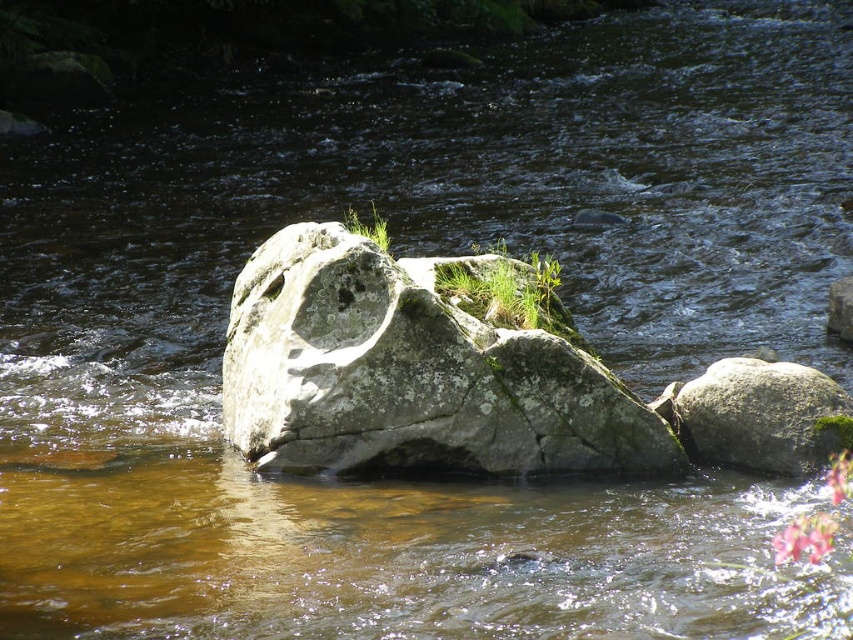
Is the position of gray rough rock at center more distant than that of gray rough rock at right?

No, it is in front of gray rough rock at right.

Which is behind, point (289, 378) or point (784, 403)?

The point (784, 403) is more distant.

What are the coordinates of `gray rough rock at center` in the screenshot? It's located at (410, 372).